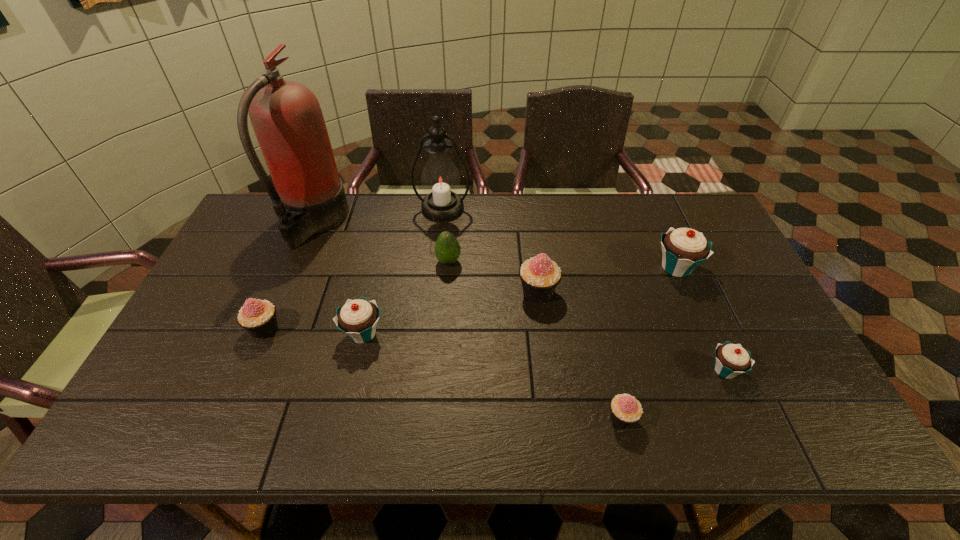
Locate an element on the screen. This screenshot has width=960, height=540. red fire extinguisher is located at coordinates (287, 119).

Identify the location of the tallest object. Image resolution: width=960 pixels, height=540 pixels. (287, 119).

Where is `the eighth shortest object`? This screenshot has width=960, height=540. the eighth shortest object is located at coordinates (440, 179).

You are a GUI agent. You are given a task and a screenshot of the screen. Output one action in this format:
    pyautogui.click(x=<x>, y=<y>)
    Task: Click on the second pink cupcake from right to left
    The image size is (960, 540).
    Given the screenshot: What is the action you would take?
    pyautogui.click(x=540, y=276)

Where is `the farthest pink cupcake`? the farthest pink cupcake is located at coordinates (540, 276).

Identify the location of the biggest teal cupcake. Image resolution: width=960 pixels, height=540 pixels. (683, 249).

Locate an element on the screen. Image resolution: width=960 pixels, height=540 pixels. the second biggest pink cupcake is located at coordinates (258, 317).

You are a GUI agent. You are given a task and a screenshot of the screen. Output one action in this format:
    pyautogui.click(x=<x>, y=<y>)
    Task: Click on the leftmost cupcake
    Image resolution: width=960 pixels, height=540 pixels.
    Given the screenshot: What is the action you would take?
    pyautogui.click(x=258, y=317)

The image size is (960, 540). What are the coordinates of `the second nearest teal cupcake` in the screenshot? It's located at (358, 318).

This screenshot has width=960, height=540. Find the location of `the second smallest teal cupcake`. the second smallest teal cupcake is located at coordinates (358, 318).